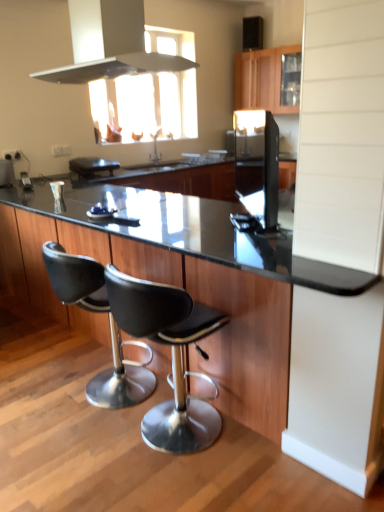
Question: Looking at their shapes, would you say black leather stool at center, placed as the first chair when sorted from left to right, is wider or thinner than metallic silver exhaust hood at upper center?

Choices:
 (A) thin
 (B) wide

Answer: (A)

Question: Is black leather stool at center, positioned as the second chair in right-to-left order, situated inside metallic silver exhaust hood at upper center or outside?

Choices:
 (A) outside
 (B) inside

Answer: (A)

Question: Estimate the real-world distances between objects in this image. Which object is farther from the black leather stool at center, which appears as the second chair when viewed from the left?

Choices:
 (A) black glossy refrigerator at center, the 2th appliance from the left
 (B) black granite countertop at center, the second countertop positioned from the right
 (C) black matte toaster at center, the first appliance when ordered from back to front
 (D) metallic silver exhaust hood at upper center
 (E) black glass countertop at center, which ranks as the second countertop in left-to-right order

Answer: (C)

Question: Considering the real-world distances, which object is closest to the black leather stool at center, which is counted as the first chair, starting from the right?

Choices:
 (A) black granite countertop at center, the first countertop viewed from the left
 (B) wooden cabinet at upper center
 (C) black leather stool at center, placed as the first chair when sorted from left to right
 (D) black matte toaster at center, which is counted as the 2th appliance, starting from the right
 (E) metallic silver exhaust hood at upper center

Answer: (A)